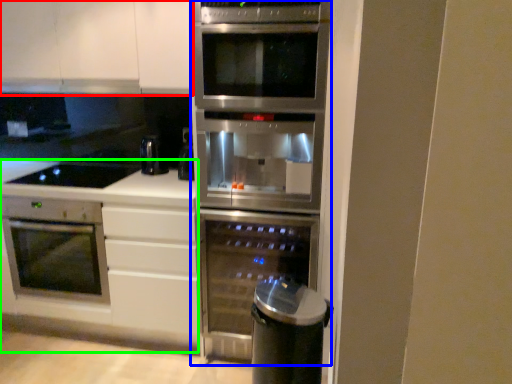
Question: Which is nearer to the cabinetry (highlighted by a red box)? fridge (highlighted by a blue box) or counter (highlighted by a green box).

Choices:
 (A) fridge
 (B) counter

Answer: (A)